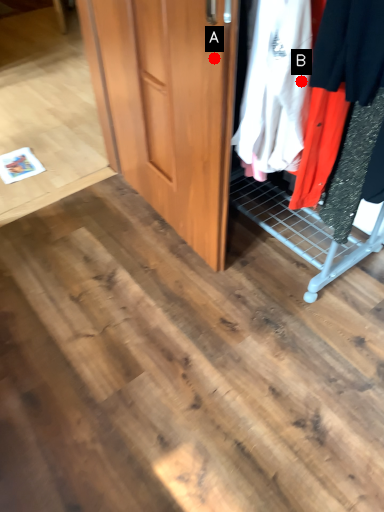
Question: Two points are circled on the image, labeled by A and B beside each circle. Which point appears closest to the camera in this image?

Choices:
 (A) A is closer
 (B) B is closer

Answer: (B)